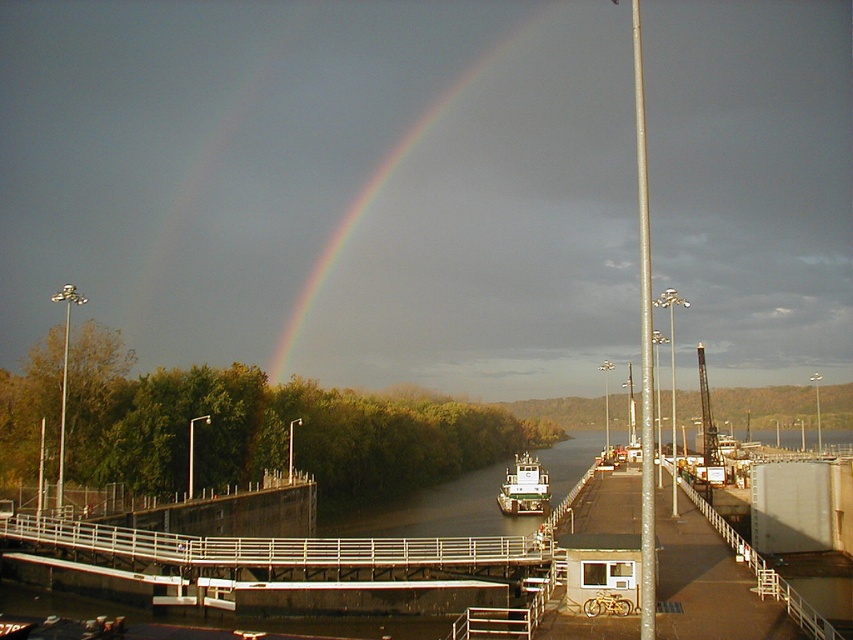
You are a photographer standing on the walkway near the lock and dam structure. You want to capture a photo of the white matte barge at center with the rainbow at upper center in the background. Is the rainbow currently positioned in a way that it can be seen behind the barge in your photo?

The rainbow at upper center is positioned over white matte barge at center, so yes, the rainbow at upper center will be visible behind the white matte barge at center in your photo.

You are an engineer inspecting the dam structure. You notice the rainbow at upper center and the white matte barge at center. Which object has a larger size in the scene?

The rainbow at upper center is bigger than the white matte barge at center according to the description.